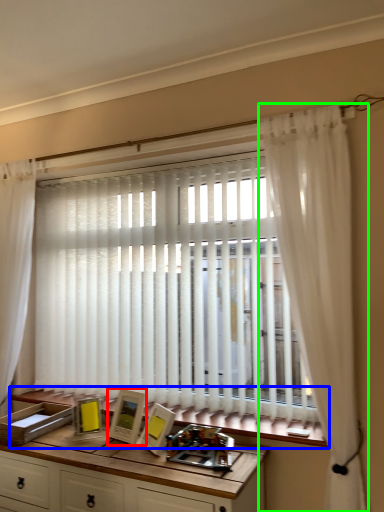
Question: Considering the real-world distances, which object is closest to picture frame (highlighted by a red box)? window sill (highlighted by a blue box) or curtain (highlighted by a green box).

Choices:
 (A) window sill
 (B) curtain

Answer: (A)